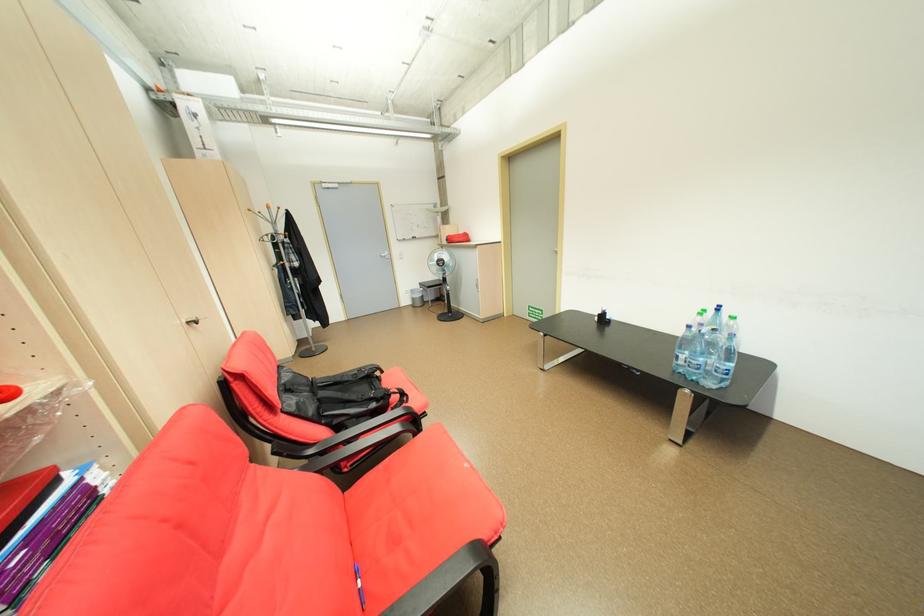
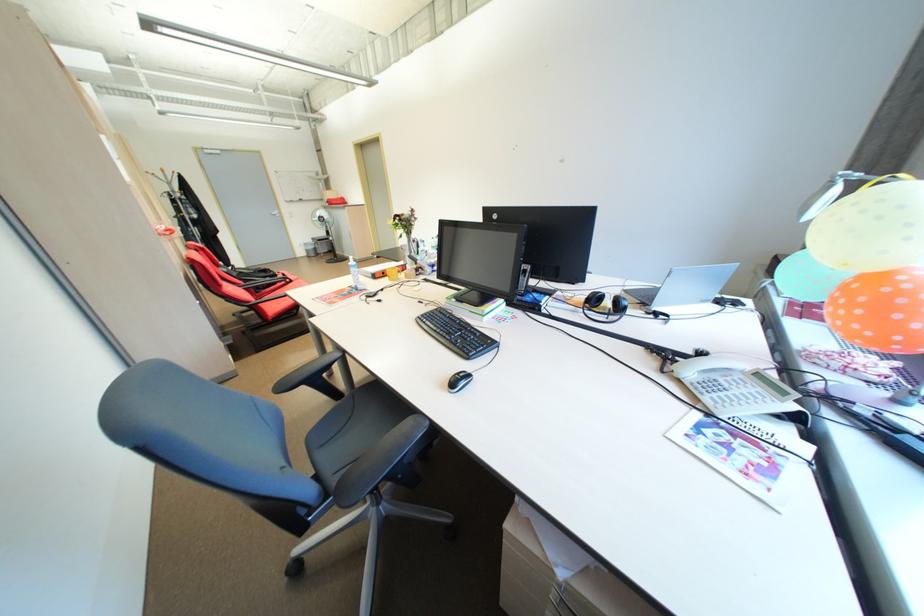
The images are taken continuously from a first-person perspective. In which direction are you moving?

The movement direction of the cameraman is right, backward.